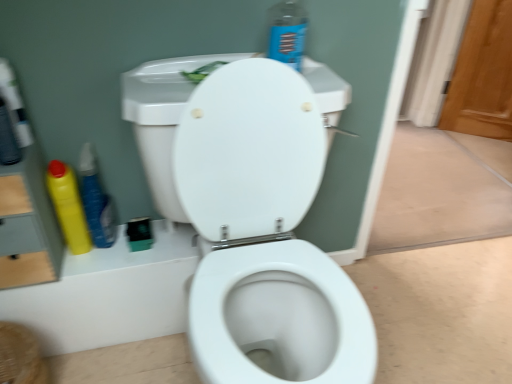
How much space does yellow plastic bottle at left, which appears as the 3th cleaning product when viewed from the right, occupy vertically?

yellow plastic bottle at left, which appears as the 3th cleaning product when viewed from the right, is 11.24 inches tall.

Measure the distance between point (x=90, y=200) and camera.

3.51 feet.

Find the location of a particular element. This screenshot has height=384, width=512. yellow plastic bottle at left, which appears as the 3th cleaning product when viewed from the right is located at coordinates (68, 206).

Choose the correct answer: Is wooden screen door at right inside yellow plastic bottle at left, which appears as the 3th cleaning product when viewed from the right, or outside it?

wooden screen door at right is outside yellow plastic bottle at left, which appears as the 3th cleaning product when viewed from the right.

Considering the sizes of objects wooden screen door at right and yellow plastic bottle at left, which appears as the 3th cleaning product when viewed from the right, in the image provided, who is taller, wooden screen door at right or yellow plastic bottle at left, which appears as the 3th cleaning product when viewed from the right,?

Standing taller between the two is wooden screen door at right.

Consider the image. What's the angular difference between wooden screen door at right and yellow plastic bottle at left, which appears as the 3th cleaning product when viewed from the right,'s facing directions?

88.8 degrees separate the facing orientations of wooden screen door at right and yellow plastic bottle at left, which appears as the 3th cleaning product when viewed from the right.

From the image's perspective, which is below, wooden screen door at right or yellow plastic bottle at left, the 1th cleaning product in the left-to-right sequence?

yellow plastic bottle at left, the 1th cleaning product in the left-to-right sequence, is shown below in the image.

Can you tell me how much wooden screen door at right and yellow plastic bottle at left, arranged as the second cleaning product when viewed from the right, differ in facing direction?

88.8 degrees separate the facing orientations of wooden screen door at right and yellow plastic bottle at left, arranged as the second cleaning product when viewed from the right.

From a real-world perspective, which is physically below, wooden screen door at right or yellow plastic bottle at left, which ranks as the second cleaning product in left-to-right order?

wooden screen door at right, from a real-world perspective.

Which of these two, wooden screen door at right or yellow plastic bottle at left, which ranks as the second cleaning product in left-to-right order, is thinner?

With smaller width is yellow plastic bottle at left, which ranks as the second cleaning product in left-to-right order.

Between wooden screen door at right and yellow plastic bottle at left, which ranks as the second cleaning product in left-to-right order, which one has less height?

yellow plastic bottle at left, which ranks as the second cleaning product in left-to-right order.

From a real-world perspective, is blue plastic spray bottle at upper center, arranged as the third cleaning product when viewed from the left, physically located above or below yellow plastic bottle at left, which ranks as the second cleaning product in left-to-right order?

blue plastic spray bottle at upper center, arranged as the third cleaning product when viewed from the left, is above yellow plastic bottle at left, which ranks as the second cleaning product in left-to-right order.

How many degrees apart are the facing directions of blue plastic spray bottle at upper center, placed as the 1th cleaning product when sorted from right to left, and yellow plastic bottle at left, arranged as the second cleaning product when viewed from the right?

1.92 degrees.

Is blue plastic spray bottle at upper center, arranged as the third cleaning product when viewed from the left, oriented towards yellow plastic bottle at left, arranged as the second cleaning product when viewed from the right?

No, blue plastic spray bottle at upper center, arranged as the third cleaning product when viewed from the left, is not turned towards yellow plastic bottle at left, arranged as the second cleaning product when viewed from the right.

Considering their positions, is blue plastic spray bottle at upper center, placed as the 1th cleaning product when sorted from right to left, located in front of or behind yellow plastic bottle at left, arranged as the second cleaning product when viewed from the right?

Visually, blue plastic spray bottle at upper center, placed as the 1th cleaning product when sorted from right to left, is located in front of yellow plastic bottle at left, arranged as the second cleaning product when viewed from the right.

You are a GUI agent. You are given a task and a screenshot of the screen. Output one action in this format:
    pyautogui.click(x=<x>, y=<y>)
    Task: Click on the cleaning product that is the 1st one when counting forward from the yellow plastic bottle at left, arranged as the second cleaning product when viewed from the right
    
    Given the screenshot: What is the action you would take?
    pyautogui.click(x=68, y=206)

Is yellow plastic bottle at left, which appears as the 3th cleaning product when viewed from the right, aimed at yellow plastic bottle at left, which ranks as the second cleaning product in left-to-right order?

No, yellow plastic bottle at left, which appears as the 3th cleaning product when viewed from the right, is not facing towards yellow plastic bottle at left, which ranks as the second cleaning product in left-to-right order.

How far apart are yellow plastic bottle at left, which appears as the 3th cleaning product when viewed from the right, and yellow plastic bottle at left, arranged as the second cleaning product when viewed from the right?

A distance of 1.70 inches exists between yellow plastic bottle at left, which appears as the 3th cleaning product when viewed from the right, and yellow plastic bottle at left, arranged as the second cleaning product when viewed from the right.

Which is in front, yellow plastic bottle at left, the 1th cleaning product in the left-to-right sequence, or yellow plastic bottle at left, arranged as the second cleaning product when viewed from the right?

yellow plastic bottle at left, the 1th cleaning product in the left-to-right sequence, is closer to the camera.

Measure the distance between yellow plastic bottle at left, the 1th cleaning product in the left-to-right sequence, and blue plastic spray bottle at upper center, placed as the 1th cleaning product when sorted from right to left.

yellow plastic bottle at left, the 1th cleaning product in the left-to-right sequence, is 62.42 centimeters away from blue plastic spray bottle at upper center, placed as the 1th cleaning product when sorted from right to left.

How many degrees apart are the facing directions of yellow plastic bottle at left, the 1th cleaning product in the left-to-right sequence, and blue plastic spray bottle at upper center, arranged as the third cleaning product when viewed from the left?

The angle between the facing direction of yellow plastic bottle at left, the 1th cleaning product in the left-to-right sequence, and the facing direction of blue plastic spray bottle at upper center, arranged as the third cleaning product when viewed from the left, is 1.92 degrees.

Are yellow plastic bottle at left, the 1th cleaning product in the left-to-right sequence, and blue plastic spray bottle at upper center, placed as the 1th cleaning product when sorted from right to left, far apart?

No.

From a real-world perspective, is yellow plastic bottle at left, the 1th cleaning product in the left-to-right sequence, below blue plastic spray bottle at upper center, arranged as the third cleaning product when viewed from the left?

Yes, from a real-world perspective, yellow plastic bottle at left, the 1th cleaning product in the left-to-right sequence, is beneath blue plastic spray bottle at upper center, arranged as the third cleaning product when viewed from the left.

Which object is positioned more to the right, yellow plastic bottle at left, which appears as the 3th cleaning product when viewed from the right, or wooden screen door at right?

Positioned to the right is wooden screen door at right.

Find the location of `cleaning product that is the 3rd one when counting downward from the wooden screen door at right (from the image's perspective)`. cleaning product that is the 3rd one when counting downward from the wooden screen door at right (from the image's perspective) is located at coordinates (68, 206).

Is yellow plastic bottle at left, which appears as the 3th cleaning product when viewed from the right, completely or partially outside of wooden screen door at right?

That's correct, yellow plastic bottle at left, which appears as the 3th cleaning product when viewed from the right, is outside of wooden screen door at right.

Does yellow plastic bottle at left, which appears as the 3th cleaning product when viewed from the right, turn towards wooden screen door at right?

No, yellow plastic bottle at left, which appears as the 3th cleaning product when viewed from the right, is not oriented towards wooden screen door at right.

From a real-world perspective, which is physically above, blue plastic spray bottle at upper center, placed as the 1th cleaning product when sorted from right to left, or yellow plastic bottle at left, the 1th cleaning product in the left-to-right sequence?

From a 3D spatial view, blue plastic spray bottle at upper center, placed as the 1th cleaning product when sorted from right to left, is above.

Is blue plastic spray bottle at upper center, placed as the 1th cleaning product when sorted from right to left, next to yellow plastic bottle at left, the 1th cleaning product in the left-to-right sequence?

No, blue plastic spray bottle at upper center, placed as the 1th cleaning product when sorted from right to left, is not touching yellow plastic bottle at left, the 1th cleaning product in the left-to-right sequence.

Is yellow plastic bottle at left, the 1th cleaning product in the left-to-right sequence, at the back of blue plastic spray bottle at upper center, placed as the 1th cleaning product when sorted from right to left?

No, blue plastic spray bottle at upper center, placed as the 1th cleaning product when sorted from right to left, is not facing away from yellow plastic bottle at left, the 1th cleaning product in the left-to-right sequence.

Considering the sizes of objects blue plastic spray bottle at upper center, placed as the 1th cleaning product when sorted from right to left, and yellow plastic bottle at left, which appears as the 3th cleaning product when viewed from the right, in the image provided, who is shorter, blue plastic spray bottle at upper center, placed as the 1th cleaning product when sorted from right to left, or yellow plastic bottle at left, which appears as the 3th cleaning product when viewed from the right,?

With less height is blue plastic spray bottle at upper center, placed as the 1th cleaning product when sorted from right to left.

The image size is (512, 384). What are the coordinates of `screen door that is above the yellow plastic bottle at left, the 1th cleaning product in the left-to-right sequence (from the image's perspective)` in the screenshot? It's located at (482, 74).

I want to click on the 1st cleaning product in front when counting from the wooden screen door at right, so click(x=96, y=200).

When comparing their distances from blue plastic spray bottle at upper center, placed as the 1th cleaning product when sorted from right to left, does yellow plastic bottle at left, which appears as the 3th cleaning product when viewed from the right, or yellow plastic bottle at left, arranged as the second cleaning product when viewed from the right, seem closer?

The object closer to blue plastic spray bottle at upper center, placed as the 1th cleaning product when sorted from right to left, is yellow plastic bottle at left, arranged as the second cleaning product when viewed from the right.

From the image, which object appears to be farther from yellow plastic bottle at left, which ranks as the second cleaning product in left-to-right order, yellow plastic bottle at left, the 1th cleaning product in the left-to-right sequence, or blue plastic spray bottle at upper center, placed as the 1th cleaning product when sorted from right to left?

The object further to yellow plastic bottle at left, which ranks as the second cleaning product in left-to-right order, is blue plastic spray bottle at upper center, placed as the 1th cleaning product when sorted from right to left.

From the image, which object appears to be farther from yellow plastic bottle at left, which ranks as the second cleaning product in left-to-right order, wooden screen door at right or yellow plastic bottle at left, the 1th cleaning product in the left-to-right sequence?

wooden screen door at right.

Estimate the real-world distances between objects in this image. Which object is closer to blue plastic spray bottle at upper center, placed as the 1th cleaning product when sorted from right to left, yellow plastic bottle at left, arranged as the second cleaning product when viewed from the right, or wooden screen door at right?

Based on the image, yellow plastic bottle at left, arranged as the second cleaning product when viewed from the right, appears to be nearer to blue plastic spray bottle at upper center, placed as the 1th cleaning product when sorted from right to left.

From the image, which object appears to be farther from wooden screen door at right, yellow plastic bottle at left, the 1th cleaning product in the left-to-right sequence, or yellow plastic bottle at left, which ranks as the second cleaning product in left-to-right order?

yellow plastic bottle at left, the 1th cleaning product in the left-to-right sequence, is positioned further to the anchor wooden screen door at right.

When comparing their distances from yellow plastic bottle at left, the 1th cleaning product in the left-to-right sequence, does blue plastic spray bottle at upper center, placed as the 1th cleaning product when sorted from right to left, or wooden screen door at right seem closer?

Based on the image, blue plastic spray bottle at upper center, placed as the 1th cleaning product when sorted from right to left, appears to be nearer to yellow plastic bottle at left, the 1th cleaning product in the left-to-right sequence.

Which object lies nearer to the anchor point wooden screen door at right, yellow plastic bottle at left, which ranks as the second cleaning product in left-to-right order, or blue plastic spray bottle at upper center, arranged as the third cleaning product when viewed from the left?

Among the two, blue plastic spray bottle at upper center, arranged as the third cleaning product when viewed from the left, is located nearer to wooden screen door at right.

From the picture: When comparing their distances from yellow plastic bottle at left, the 1th cleaning product in the left-to-right sequence, does yellow plastic bottle at left, arranged as the second cleaning product when viewed from the right, or wooden screen door at right seem further?

Among the two, wooden screen door at right is located further to yellow plastic bottle at left, the 1th cleaning product in the left-to-right sequence.

Identify the location of cleaning product between yellow plastic bottle at left, the 1th cleaning product in the left-to-right sequence, and blue plastic spray bottle at upper center, placed as the 1th cleaning product when sorted from right to left, from left to right. pos(96,200).

This screenshot has width=512, height=384. What are the coordinates of `cleaning product between yellow plastic bottle at left, arranged as the second cleaning product when viewed from the right, and wooden screen door at right from left to right` in the screenshot? It's located at (287, 33).